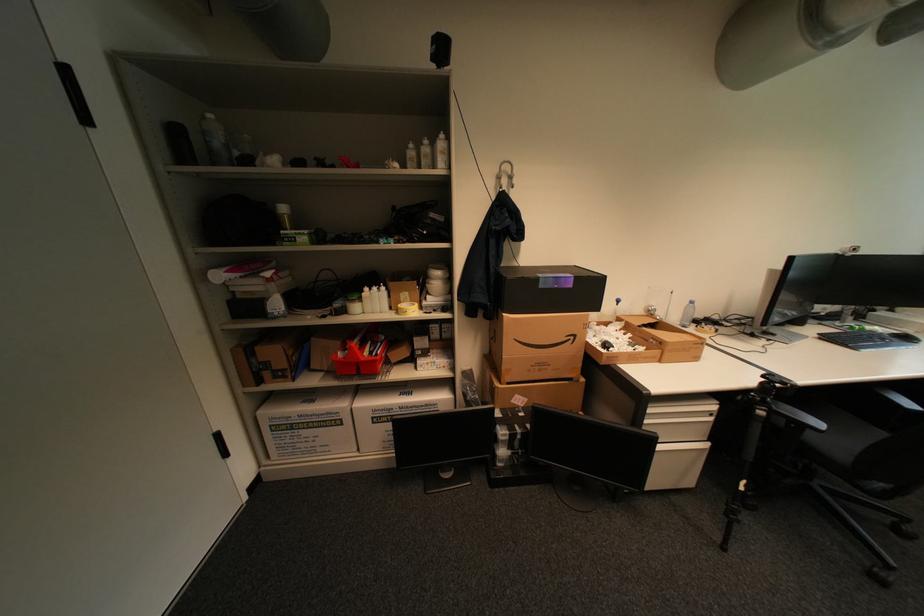
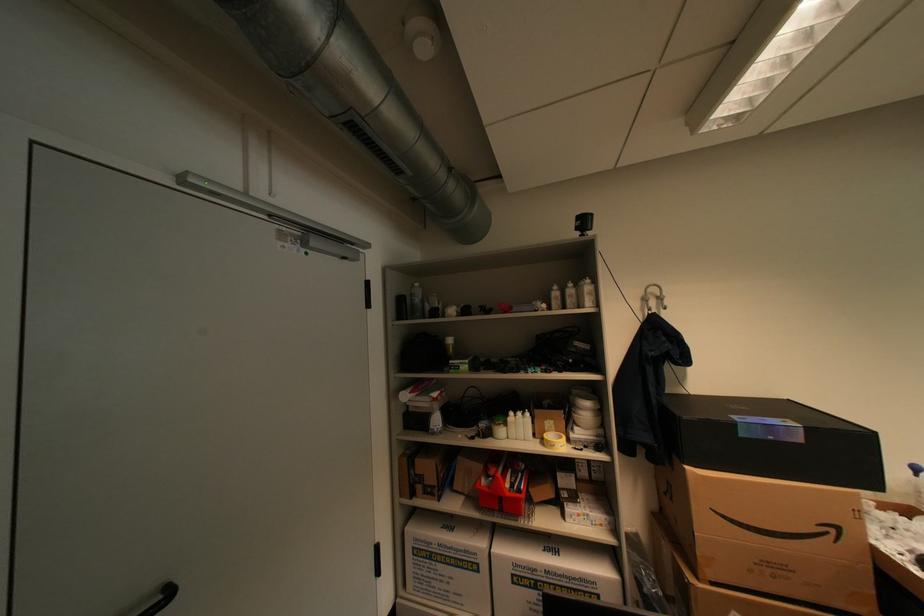
In the second image, find the point that corresponds to the point at 403,312 in the first image.

(546, 440)